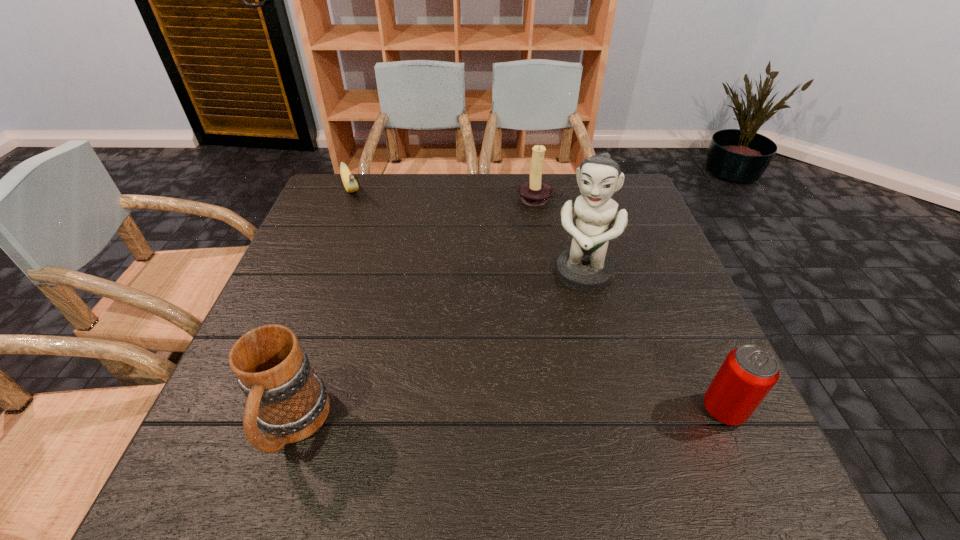
Image resolution: width=960 pixels, height=540 pixels. What are the coordinates of `unoccupied area between the rightmost object and the third nearest object` in the screenshot? It's located at (653, 342).

This screenshot has height=540, width=960. Identify the location of vacant area that lies between the fourth tallest object and the tallest object. (653, 342).

Locate an element on the screen. The height and width of the screenshot is (540, 960). free spot between the banana and the can is located at coordinates (538, 300).

The height and width of the screenshot is (540, 960). In order to click on vacant area that lies between the rightmost object and the banana in this screenshot , I will do `click(538, 300)`.

Find the location of `object identified as the closest to the candle holder`. object identified as the closest to the candle holder is located at coordinates (585, 266).

Point out which object is positioned as the third nearest to the mug. Please provide its 2D coordinates. Your answer should be formatted as a tuple, i.e. [(x, y)], where the tuple contains the x and y coordinates of a point satisfying the conditions above.

[(748, 373)]

What are the coordinates of `vacant space that satisfies the following two spatial constraints: 1. on the front side of the third farthest object; 2. on the left side of the banana` in the screenshot? It's located at (318, 275).

Locate an element on the screen. vacant space that satisfies the following two spatial constraints: 1. on the front side of the candle holder; 2. on the right side of the rightmost object is located at coordinates (576, 410).

At what (x,y) coordinates should I click in order to perform the action: click on free point that satisfies the following two spatial constraints: 1. on the front side of the rightmost object; 2. on the left side of the candle holder. Please return your answer as a coordinate pair (x, y). This screenshot has width=960, height=540. Looking at the image, I should click on (576, 410).